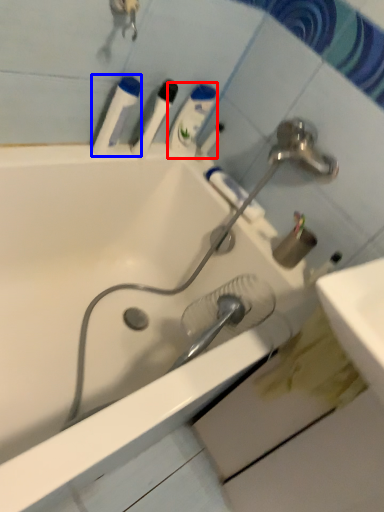
Question: Which object appears closest to the camera in this image, mouthwash (highlighted by a red box) or mouthwash (highlighted by a blue box)?

Choices:
 (A) mouthwash
 (B) mouthwash

Answer: (B)